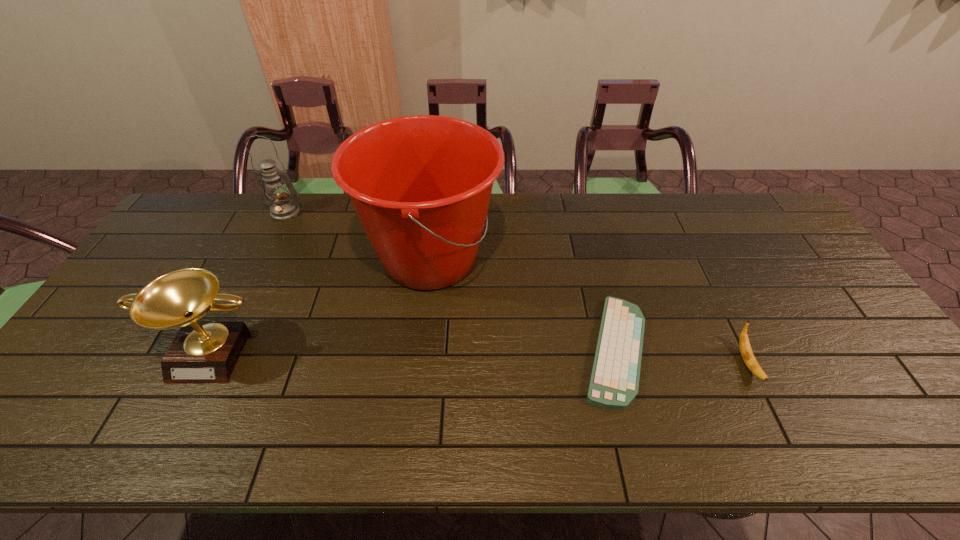
Identify which object is the third closest to the award. Please provide its 2D coordinates. Your answer should be formatted as a tuple, i.e. [(x, y)], where the tuple contains the x and y coordinates of a point satisfying the conditions above.

[(614, 382)]

Image resolution: width=960 pixels, height=540 pixels. Find the location of `blank space that satisfies the following two spatial constraints: 1. with the handle attached to the rim of the shortest object; 2. on the left side of the tallest object`. blank space that satisfies the following two spatial constraints: 1. with the handle attached to the rim of the shortest object; 2. on the left side of the tallest object is located at coordinates (420, 350).

Find the location of a particular element. The width and height of the screenshot is (960, 540). vacant position in the image that satisfies the following two spatial constraints: 1. with the handle attached to the rim of the bucket; 2. on the back side of the computer keyboard is located at coordinates (420, 350).